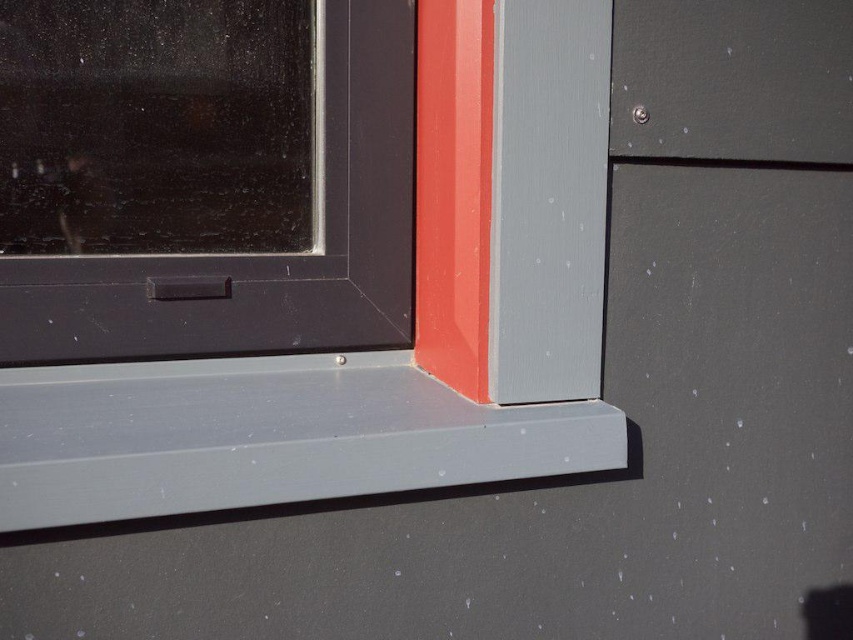
Who is positioned more to the right, matte plastic window frame at lower right or matte black window at upper left?

From the viewer's perspective, matte plastic window frame at lower right appears more on the right side.

Can you confirm if matte plastic window frame at lower right is wider than matte black window at upper left?

Yes, matte plastic window frame at lower right is wider than matte black window at upper left.

Measure the distance between matte plastic window frame at lower right and camera.

32.68 inches

This screenshot has width=853, height=640. I want to click on matte plastic window frame at lower right, so click(415, 320).

Who is more forward, (x=404, y=444) or (x=154, y=332)?

Point (x=404, y=444) is more forward.

Can you confirm if matte gray plastic at lower center is thinner than matte black window at upper left?

No, matte gray plastic at lower center is not thinner than matte black window at upper left.

Is point (405, 376) in front of point (354, 173)?

No, it is not.

This screenshot has width=853, height=640. Identify the location of matte gray plastic at lower center. (265, 435).

Can you confirm if matte plastic window frame at lower right is shorter than matte gray plastic at lower center?

Incorrect, matte plastic window frame at lower right's height does not fall short of matte gray plastic at lower center's.

Is matte plastic window frame at lower right to the right of matte gray plastic at lower center from the viewer's perspective?

Correct, you'll find matte plastic window frame at lower right to the right of matte gray plastic at lower center.

Which is behind, point (405, 438) or point (347, 374)?

The point (347, 374) is more distant.

I want to click on matte plastic window frame at lower right, so click(x=415, y=320).